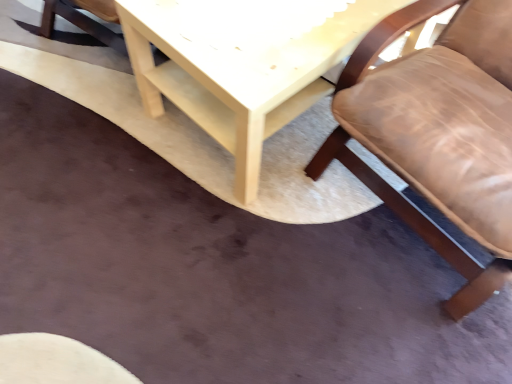
Where is `brown leather chair at upper right`? brown leather chair at upper right is located at coordinates (438, 131).

In the scene shown: What is the approximate width of brown leather chair at upper right?

brown leather chair at upper right is 35.14 inches wide.

What do you see at coordinates (438, 131) in the screenshot? This screenshot has width=512, height=384. I see `brown leather chair at upper right` at bounding box center [438, 131].

What do you see at coordinates (242, 64) in the screenshot? This screenshot has height=384, width=512. I see `light wood table at upper center` at bounding box center [242, 64].

Locate an element on the screen. This screenshot has height=384, width=512. light wood table at upper center is located at coordinates (242, 64).

At what (x,y) coordinates should I click in order to perform the action: click on brown leather chair at upper right. Please return your answer as a coordinate pair (x, y). This screenshot has width=512, height=384. Looking at the image, I should click on (438, 131).

Does light wood table at upper center appear on the right side of brown leather chair at upper right?

No, light wood table at upper center is not to the right of brown leather chair at upper right.

Which object is further away from the camera taking this photo, light wood table at upper center or brown leather chair at upper right?

light wood table at upper center is behind.

Considering the positions of points (344, 53) and (433, 68), is point (344, 53) farther from camera compared to point (433, 68)?

No, it is in front of (433, 68).

From the image's perspective, is light wood table at upper center located above or below brown leather chair at upper right?

light wood table at upper center is above brown leather chair at upper right.

From a real-world perspective, which is physically above, light wood table at upper center or brown leather chair at upper right?

brown leather chair at upper right, from a real-world perspective.

Is light wood table at upper center wider than brown leather chair at upper right?

Yes, light wood table at upper center is wider than brown leather chair at upper right.

Is light wood table at upper center taller or shorter than brown leather chair at upper right?

Considering their sizes, light wood table at upper center has less height than brown leather chair at upper right.

Can you confirm if light wood table at upper center is smaller than brown leather chair at upper right?

Correct, light wood table at upper center occupies less space than brown leather chair at upper right.

Consider the image. Is light wood table at upper center inside or outside of brown leather chair at upper right?

light wood table at upper center is spatially situated outside brown leather chair at upper right.

Are light wood table at upper center and brown leather chair at upper right located far from each other?

No, light wood table at upper center is not far away from brown leather chair at upper right.

Is light wood table at upper center aimed at brown leather chair at upper right?

No, light wood table at upper center is not oriented towards brown leather chair at upper right.

How many degrees apart are the facing directions of light wood table at upper center and brown leather chair at upper right?

light wood table at upper center and brown leather chair at upper right are facing 4.09 degrees away from each other.

The width and height of the screenshot is (512, 384). What are the coordinates of `chair in front of the light wood table at upper center` in the screenshot? It's located at (438, 131).

Can you confirm if brown leather chair at upper right is positioned to the right of light wood table at upper center?

Correct, you'll find brown leather chair at upper right to the right of light wood table at upper center.

Is brown leather chair at upper right further to the viewer compared to light wood table at upper center?

No, brown leather chair at upper right is in front of light wood table at upper center.

Is point (494, 85) positioned behind point (333, 18)?

No, it is in front of (333, 18).

From the image's perspective, is brown leather chair at upper right beneath light wood table at upper center?

Yes, from the image's perspective, brown leather chair at upper right is below light wood table at upper center.

From a real-world perspective, is brown leather chair at upper right located higher than light wood table at upper center?

Yes, from a real-world perspective, brown leather chair at upper right is on top of light wood table at upper center.

Between brown leather chair at upper right and light wood table at upper center, which one has larger width?

light wood table at upper center.

Considering the relative sizes of brown leather chair at upper right and light wood table at upper center in the image provided, is brown leather chair at upper right taller than light wood table at upper center?

Indeed, brown leather chair at upper right has a greater height compared to light wood table at upper center.

Considering the sizes of objects brown leather chair at upper right and light wood table at upper center in the image provided, who is smaller, brown leather chair at upper right or light wood table at upper center?

Smaller between the two is light wood table at upper center.

Is brown leather chair at upper right situated inside light wood table at upper center or outside?

brown leather chair at upper right is outside light wood table at upper center.

Is brown leather chair at upper right not close to light wood table at upper center?

No, brown leather chair at upper right is not far away from light wood table at upper center.

Is brown leather chair at upper right facing away from light wood table at upper center?

No, brown leather chair at upper right is not facing the opposite direction of light wood table at upper center.

What's the angular difference between brown leather chair at upper right and light wood table at upper center's facing directions?

4.09 degrees.

How far apart are brown leather chair at upper right and light wood table at upper center?

brown leather chair at upper right and light wood table at upper center are 12.29 inches apart.

Identify the location of table behind the brown leather chair at upper right. The image size is (512, 384). (242, 64).

The height and width of the screenshot is (384, 512). I want to click on chair on the right of light wood table at upper center, so click(x=438, y=131).

Identify the location of table to the left of brown leather chair at upper right. Image resolution: width=512 pixels, height=384 pixels. (242, 64).